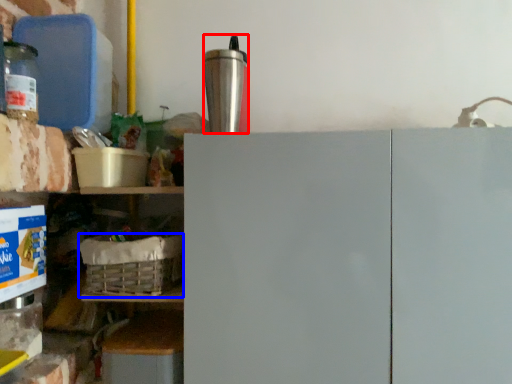
Question: Which object appears farthest to the camera in this image, appliance (highlighted by a red box) or basket (highlighted by a blue box)?

Choices:
 (A) appliance
 (B) basket

Answer: (B)